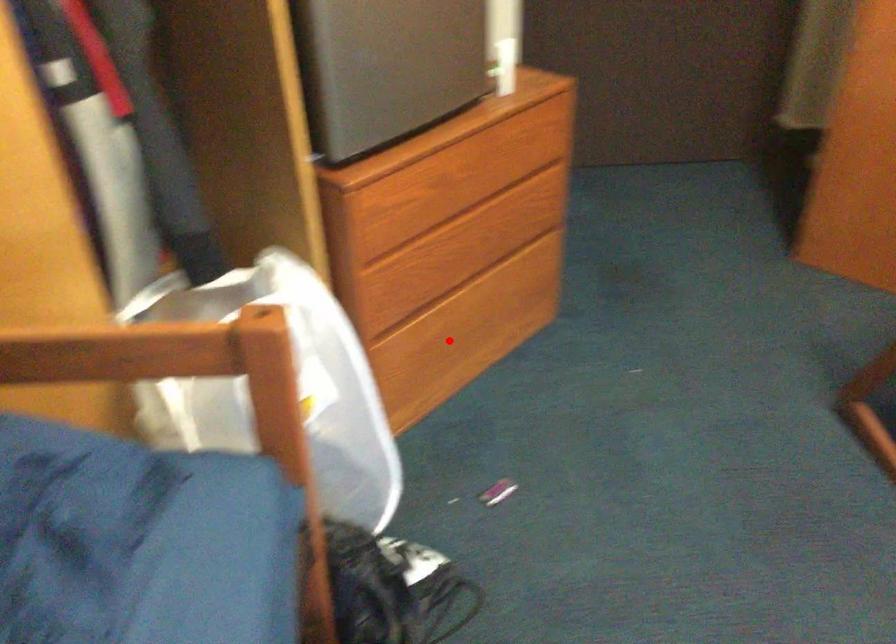
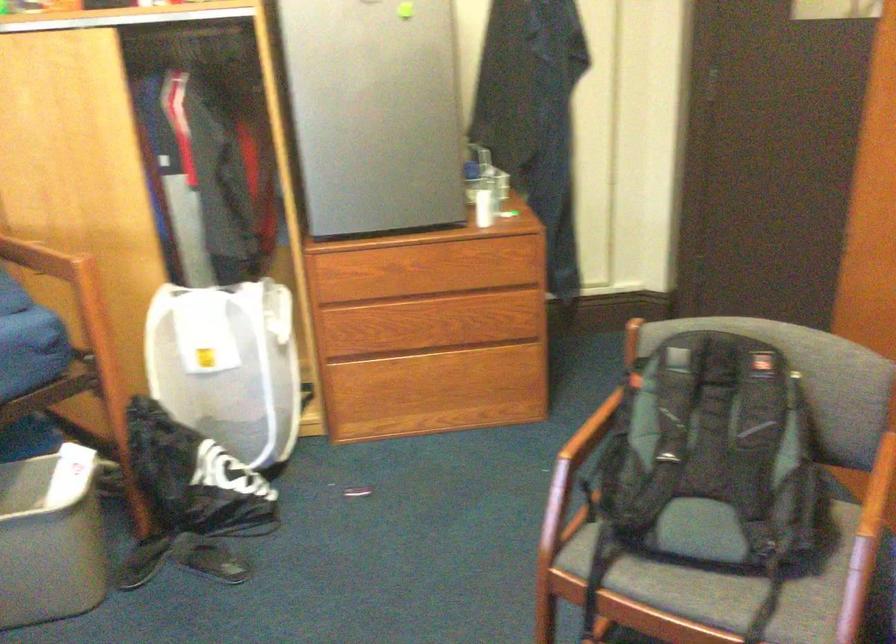
Question: I am providing you with two images of the same scene from different viewpoints. Image1 has a red point marked. In image2, the corresponding 3D location appears at what relative position? Reply with the corresponding letter.

Choices:
 (A) Closer
 (B) Farther

Answer: (B)